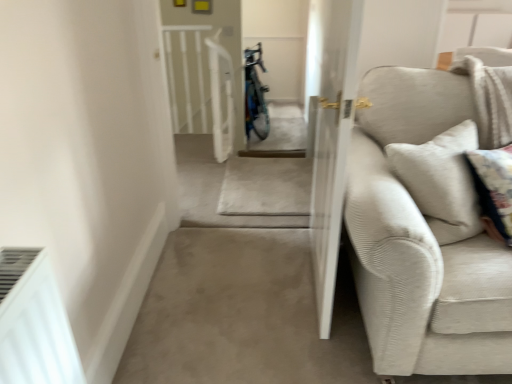
This screenshot has height=384, width=512. Identify the location of vacant region to the left of white textured screen door at center. click(x=243, y=279).